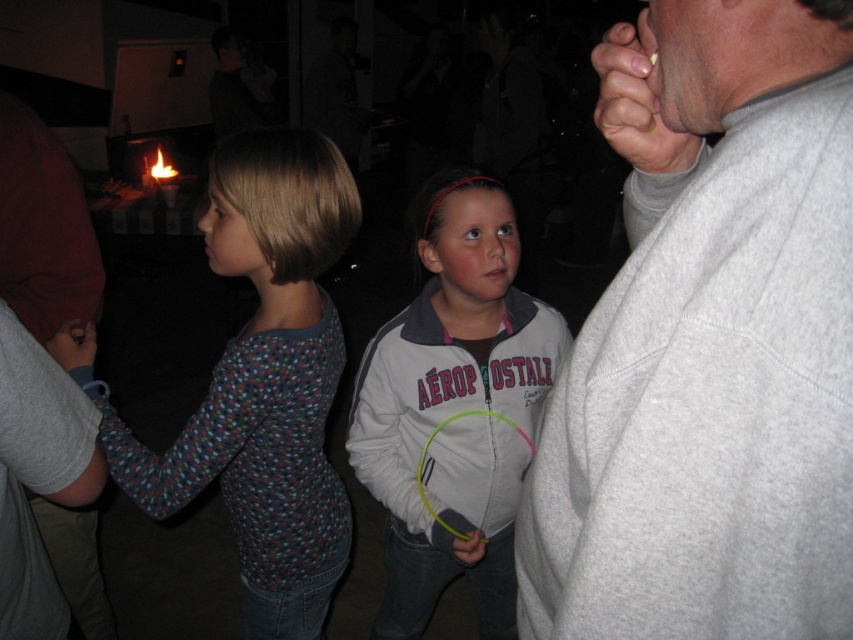
Can you confirm if multicolored knit sweater at left is bigger than gray matte hand at upper right?

No.

Who is higher up, multicolored knit sweater at left or gray matte hand at upper right?

Positioned higher is gray matte hand at upper right.

Find the location of `multicolored knit sweater at left`. multicolored knit sweater at left is located at coordinates (265, 380).

Is gray fleece sweatshirt at right above white fleece jacket at center?

Yes.

Who is shorter, gray fleece sweatshirt at right or white fleece jacket at center?

Standing shorter between the two is gray fleece sweatshirt at right.

Is point (805, 525) closer to viewer compared to point (560, 342)?

Yes, point (805, 525) is in front of point (560, 342).

Image resolution: width=853 pixels, height=640 pixels. I want to click on gray fleece sweatshirt at right, so click(x=709, y=344).

Between white fleece jacket at center and gray matte hand at upper right, which one has less height?

Standing shorter between the two is gray matte hand at upper right.

Which is below, white fleece jacket at center or gray matte hand at upper right?

Positioned lower is white fleece jacket at center.

Is point (469, 225) farther from camera compared to point (654, 152)?

Yes, point (469, 225) is farther from viewer.

Find the location of a particular element. The image size is (853, 640). white fleece jacket at center is located at coordinates (454, 408).